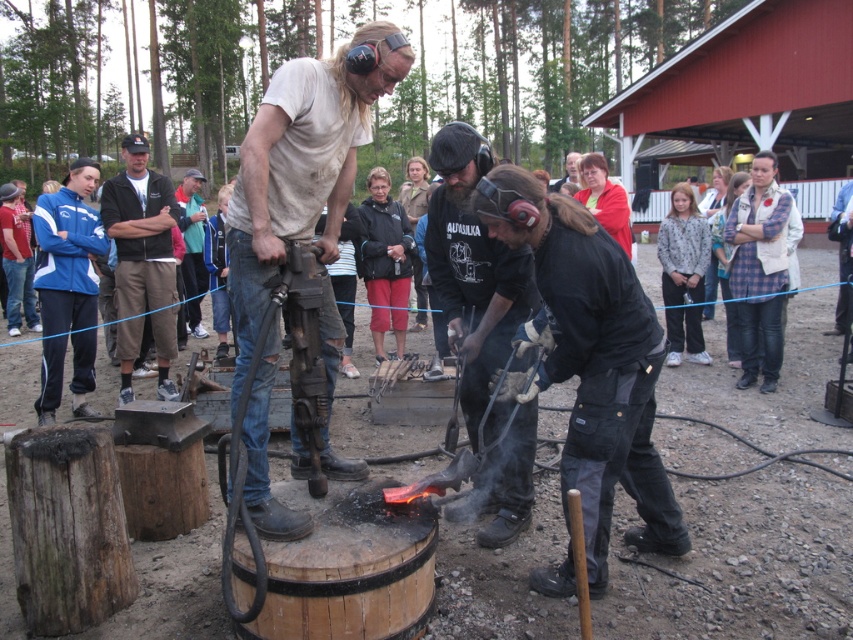
Does black leather gloves at center appear over black cotton jacket at upper left?

Incorrect, black leather gloves at center is not positioned above black cotton jacket at upper left.

Between black leather gloves at center and black cotton jacket at upper left, which one is positioned lower?

black leather gloves at center is below.

Is point (436, 164) positioned before point (148, 220)?

Yes, it is.

Where is `black leather gloves at center`? black leather gloves at center is located at coordinates (473, 269).

Between point (247, 442) and point (169, 275), which one is positioned behind?

Point (169, 275)

Who is more distant from viewer, (277, 513) or (169, 234)?

The point (169, 234) is more distant.

This screenshot has height=640, width=853. I want to click on dirty white shirt at center, so click(305, 177).

Measure the distance between dirty white shirt at center and camera.

dirty white shirt at center is 2.59 meters from camera.

Which is more to the left, dirty white shirt at center or black leather gloves at center?

dirty white shirt at center is more to the left.

Identify the location of dirty white shirt at center. (305, 177).